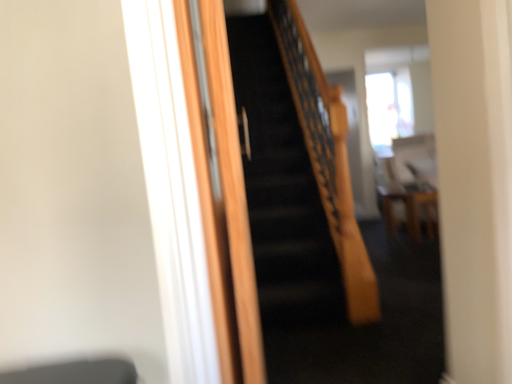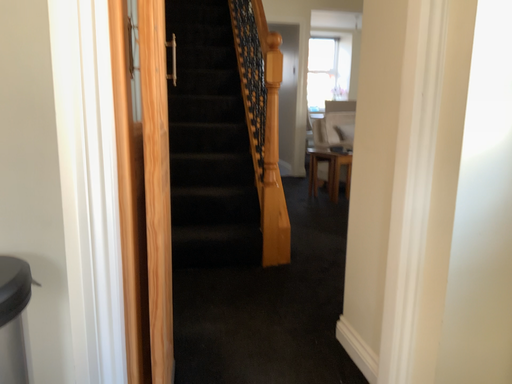
Question: How did the camera likely rotate when shooting the video?

Choices:
 (A) rotated left
 (B) rotated right

Answer: (B)